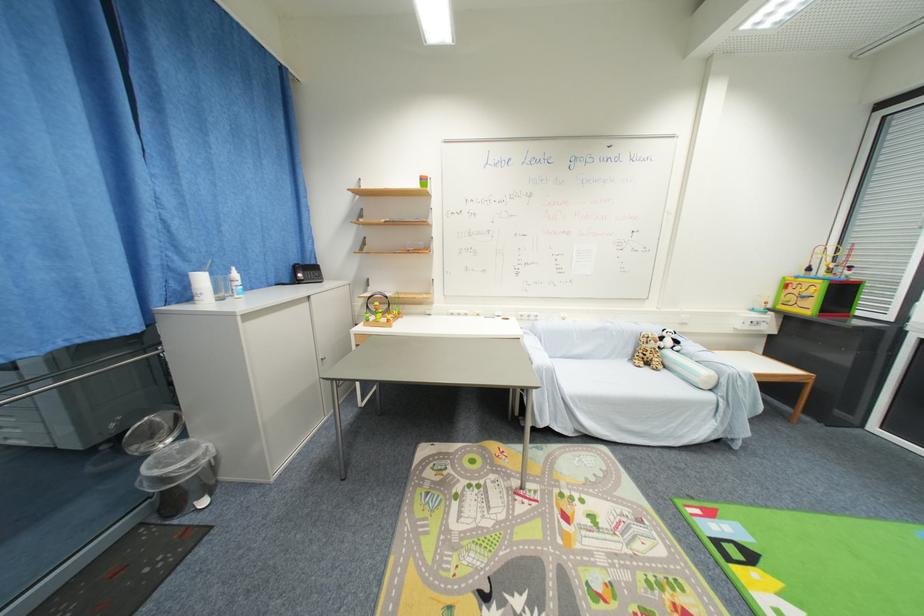
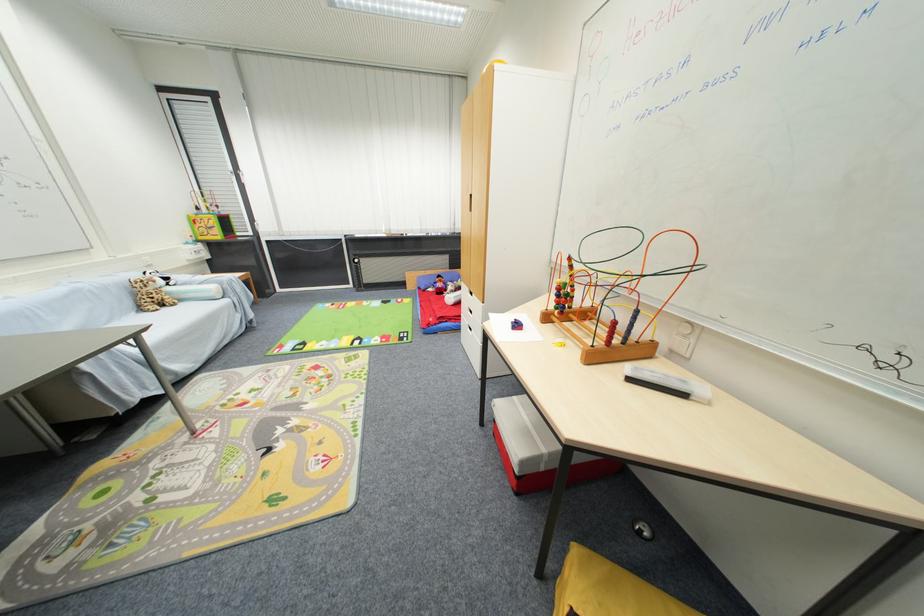
Locate, in the second image, the point that corresponds to [638,361] in the first image.

(146, 310)